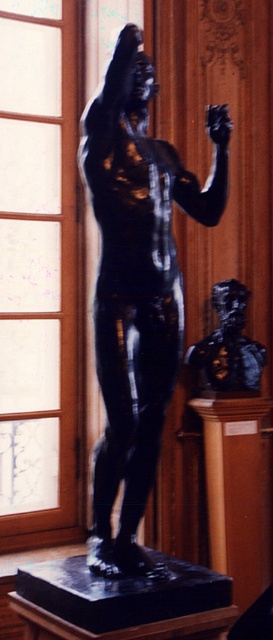
How far apart are black polished statue at center and black polished bust at center?

3.52 feet

Looking at this image, does black polished statue at center appear on the left side of black polished bust at center?

Yes, black polished statue at center is to the left of black polished bust at center.

Between point (102, 394) and point (241, 388), which one is positioned behind?

The point (241, 388) is more distant.

I want to click on black polished statue at center, so click(137, 289).